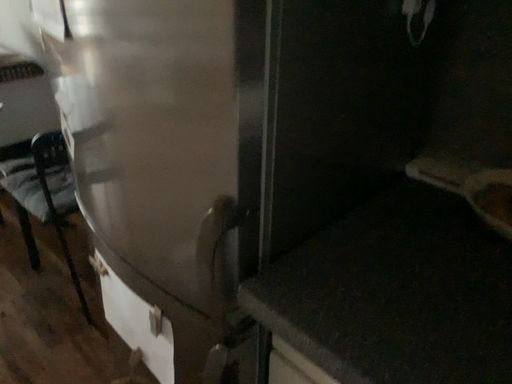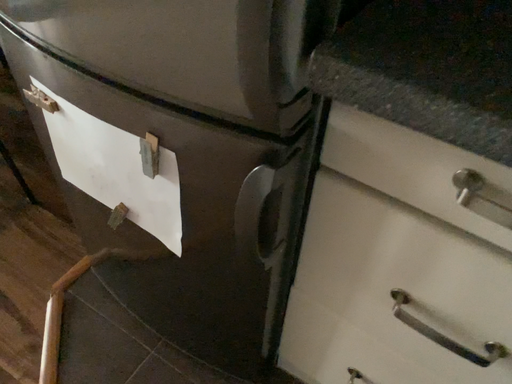
Question: Which way did the camera rotate in the video?

Choices:
 (A) rotated downward
 (B) rotated upward

Answer: (A)